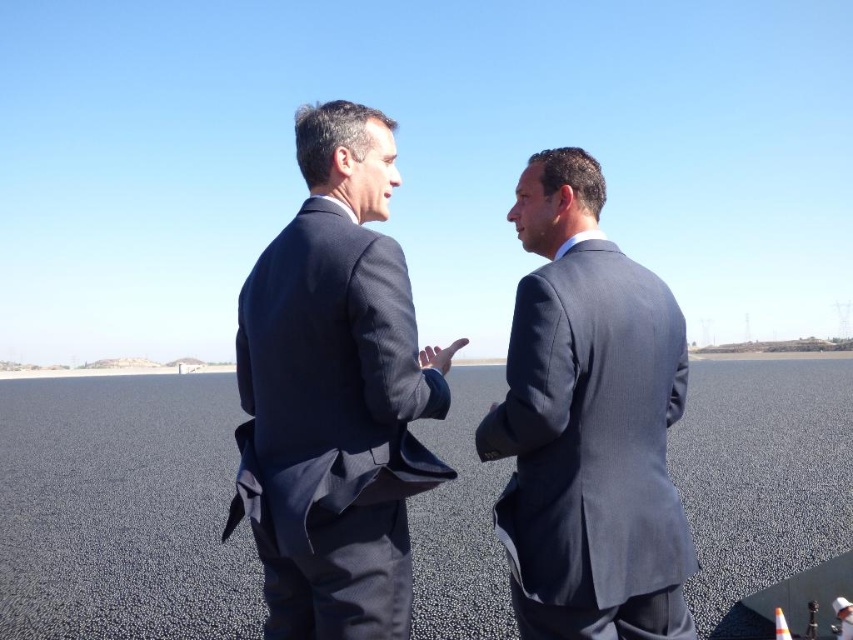
Question: Does black asphalt tarmac at center have a lesser width compared to matte gray suit at center?

Choices:
 (A) no
 (B) yes

Answer: (A)

Question: Estimate the real-world distances between objects in this image. Which object is closer to the black asphalt tarmac at center?

Choices:
 (A) dark blue suit at center
 (B) matte gray suit at center

Answer: (A)

Question: Can you confirm if black asphalt tarmac at center is positioned below dark blue suit at center?

Choices:
 (A) no
 (B) yes

Answer: (B)

Question: Which point is farther to the camera?

Choices:
 (A) matte gray suit at center
 (B) dark blue suit at center

Answer: (A)

Question: Which point is closer to the camera?

Choices:
 (A) (0, 552)
 (B) (380, 154)
 (C) (546, 227)

Answer: (B)

Question: Observing the image, what is the correct spatial positioning of black asphalt tarmac at center in reference to matte gray suit at center?

Choices:
 (A) right
 (B) left

Answer: (A)